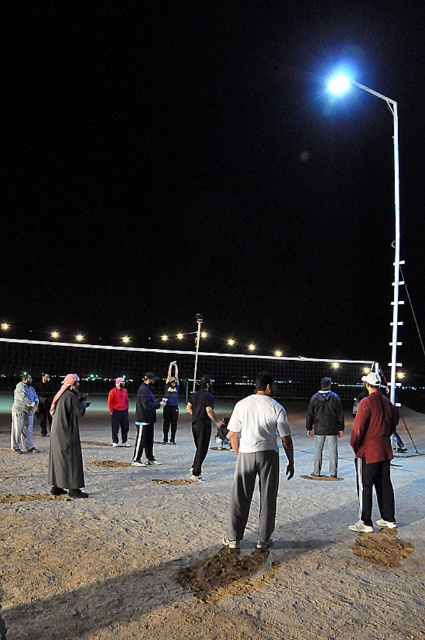
Question: Which of these objects is positioned closest to the dark gray jacket at center?

Choices:
 (A) dark gray matte robe at left
 (B) brown sand at center

Answer: (B)

Question: Is white matte shirt at center thinner than gray fabric robe at left?

Choices:
 (A) yes
 (B) no

Answer: (B)

Question: Which point is farther from the camera taking this photo?

Choices:
 (A) (70, 436)
 (B) (370, 524)
 (C) (240, 417)
 (D) (17, 406)

Answer: (D)

Question: Does maroon fabric jacket at center appear over gray fabric robe at left?

Choices:
 (A) yes
 (B) no

Answer: (A)

Question: Based on their relative distances, which object is farther from the dark gray matte robe at left?

Choices:
 (A) dark gray fabric jacket at center
 (B) black matte pants at center

Answer: (A)

Question: Does maroon fabric jacket at center have a smaller size compared to red fabric shirt at center?

Choices:
 (A) no
 (B) yes

Answer: (A)